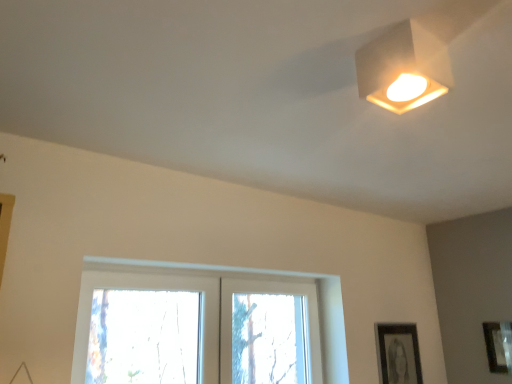
Question: Is white matte square lamp at upper right bigger than black matte picture frame at lower right, the first picture frame in the left-to-right sequence?

Choices:
 (A) no
 (B) yes

Answer: (B)

Question: From the image's perspective, is white matte square lamp at upper right over black matte picture frame at lower right, the first picture frame in the left-to-right sequence?

Choices:
 (A) yes
 (B) no

Answer: (A)

Question: Does white matte square lamp at upper right have a greater height compared to black matte picture frame at lower right, which is the 2th picture frame in right-to-left order?

Choices:
 (A) no
 (B) yes

Answer: (A)

Question: Can you confirm if white matte square lamp at upper right is positioned to the right of black matte picture frame at lower right, the first picture frame in the left-to-right sequence?

Choices:
 (A) no
 (B) yes

Answer: (A)

Question: From a real-world perspective, is white matte square lamp at upper right positioned over black matte picture frame at lower right, which is the 2th picture frame in right-to-left order, based on gravity?

Choices:
 (A) no
 (B) yes

Answer: (B)

Question: Is point (407, 29) positioned closer to the camera than point (498, 339)?

Choices:
 (A) closer
 (B) farther

Answer: (A)

Question: From the image's perspective, is white matte square lamp at upper right above or below matte black picture frame at lower right, the first picture frame from the right?

Choices:
 (A) below
 (B) above

Answer: (B)

Question: From a real-world perspective, is white matte square lamp at upper right positioned above or below matte black picture frame at lower right, the 2th picture frame in the left-to-right sequence?

Choices:
 (A) below
 (B) above

Answer: (B)

Question: Is white matte square lamp at upper right wider or thinner than matte black picture frame at lower right, the first picture frame from the right?

Choices:
 (A) wide
 (B) thin

Answer: (A)

Question: Is black matte picture frame at lower right, the first picture frame in the left-to-right sequence, inside the boundaries of matte black picture frame at lower right, the first picture frame from the right, or outside?

Choices:
 (A) outside
 (B) inside

Answer: (A)

Question: Is point (403, 365) closer or farther from the camera than point (508, 352)?

Choices:
 (A) closer
 (B) farther

Answer: (B)

Question: Based on their positions, is black matte picture frame at lower right, the first picture frame in the left-to-right sequence, located to the left or right of matte black picture frame at lower right, the first picture frame from the right?

Choices:
 (A) right
 (B) left

Answer: (B)

Question: Looking at their shapes, would you say black matte picture frame at lower right, the first picture frame in the left-to-right sequence, is wider or thinner than matte black picture frame at lower right, the 2th picture frame in the left-to-right sequence?

Choices:
 (A) wide
 (B) thin

Answer: (B)

Question: Is black matte picture frame at lower right, the first picture frame in the left-to-right sequence, taller or shorter than clear glass window at center?

Choices:
 (A) short
 (B) tall

Answer: (A)

Question: Which is correct: black matte picture frame at lower right, which is the 2th picture frame in right-to-left order, is inside clear glass window at center, or outside of it?

Choices:
 (A) outside
 (B) inside

Answer: (A)